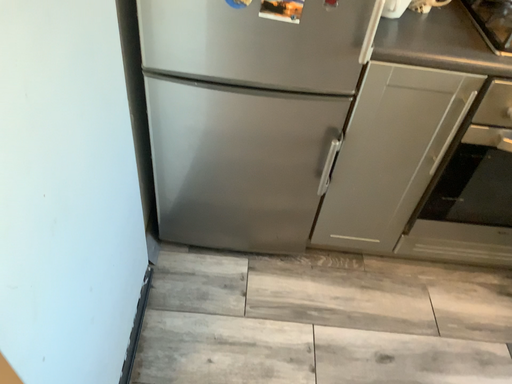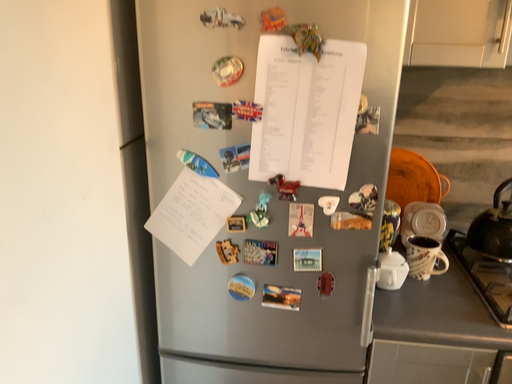
Question: How did the camera likely rotate when shooting the video?

Choices:
 (A) rotated downward
 (B) rotated upward

Answer: (B)